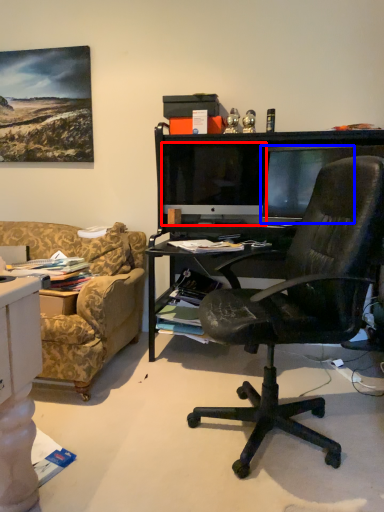
Question: Which object appears closest to the camera in this image, computer monitor (highlighted by a red box) or computer monitor (highlighted by a blue box)?

Choices:
 (A) computer monitor
 (B) computer monitor

Answer: (B)